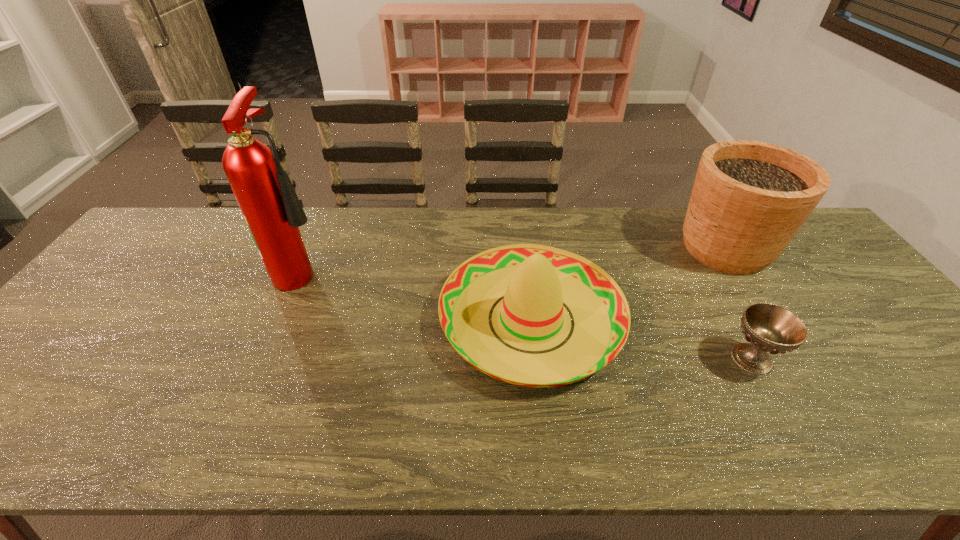
Where is `fire extinguisher`? The image size is (960, 540). fire extinguisher is located at coordinates (270, 206).

Find the location of a particular element. The height and width of the screenshot is (540, 960). the leftmost object is located at coordinates (270, 206).

The height and width of the screenshot is (540, 960). What are the coordinates of `the second tallest object` in the screenshot? It's located at (749, 199).

In order to click on the second shortest object in this screenshot , I will do `click(535, 280)`.

Locate an element on the screen. sombrero is located at coordinates (535, 280).

Where is `chalice`? The image size is (960, 540). chalice is located at coordinates (770, 328).

Locate an element on the screen. This screenshot has width=960, height=540. vacant space located at the nozzle of the tallest object is located at coordinates (447, 269).

This screenshot has height=540, width=960. What are the coordinates of `free location located 0.170m on the front of the flowerpot` in the screenshot? It's located at (777, 328).

Find the location of a particular element. free space located 0.210m on the back of the second object from left to right is located at coordinates (520, 219).

Where is `free spot located 0.200m on the back of the shortest object`? free spot located 0.200m on the back of the shortest object is located at coordinates (710, 283).